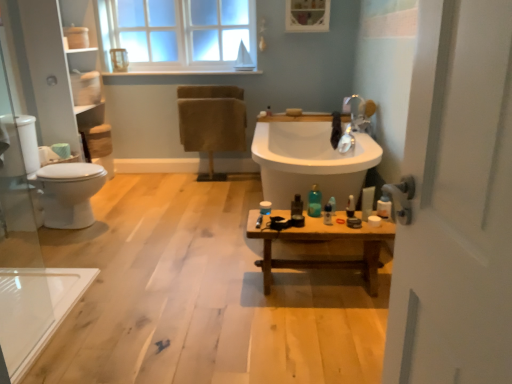
Identify the location of free spot in front of white glossy toilet at left. (53, 247).